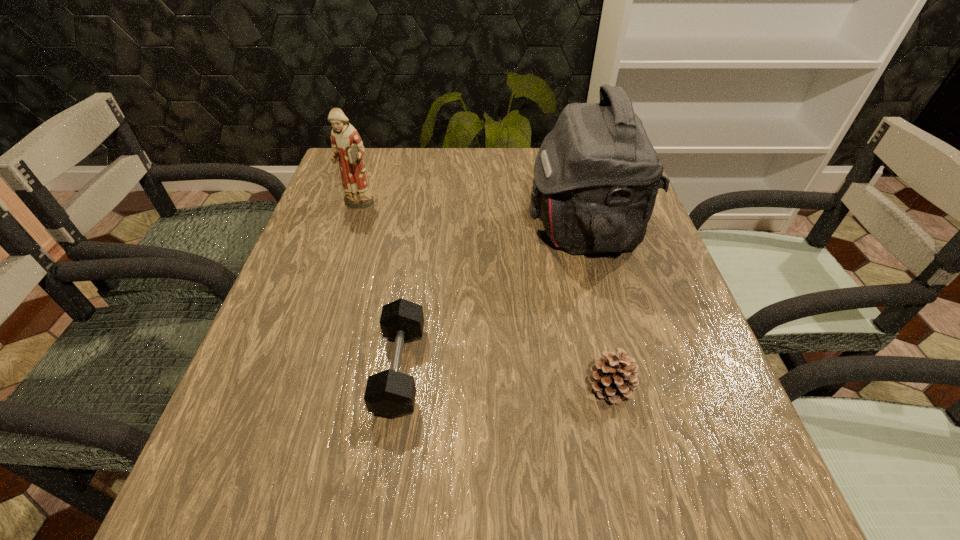
The width and height of the screenshot is (960, 540). In order to click on free space that satisfies the following two spatial constraints: 1. on the front-facing side of the dumbbell; 2. on the right side of the figurine in this screenshot , I will do pyautogui.click(x=303, y=369).